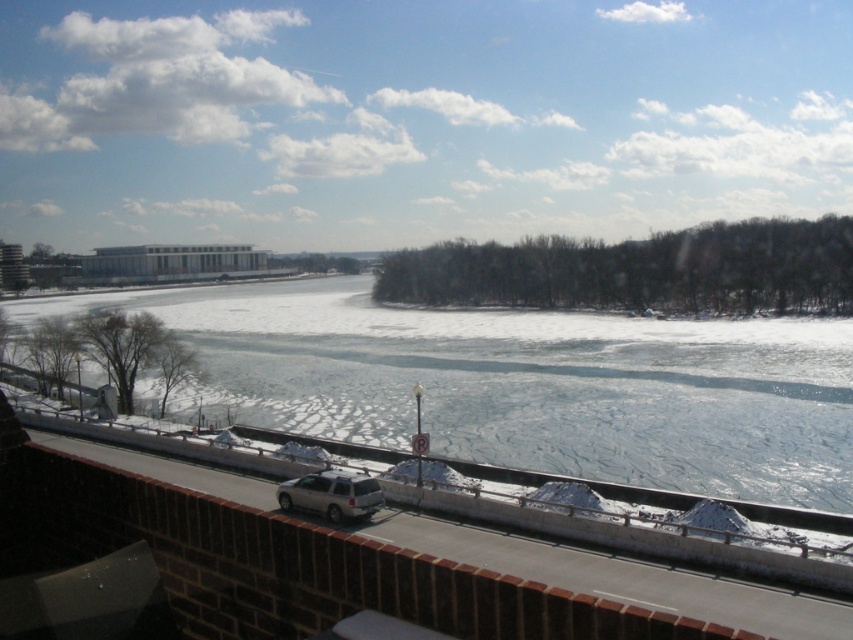
Consider the image. You are standing on the rooftop where the silver SUV is parked. You want to throw a small snowball to hit the frozen ice at center. Is the distance feasible for an average person?

The frozen ice at center is 29.89 meters away from camera. An average person can throw a snowball about 20 meters, so it would be difficult to reach the frozen ice at center from here.

Looking at this image, you are a delivery person trying to park your vehicle on the frozen ice at center. The silver metallic suv at center is already parked there. Can you park your vehicle next to the SUV without going over the edge of the ice? Please explain your reasoning based on their positions.

The frozen ice at center is positioned on the left side of the silver metallic suv at center. Since the SUV is already parked there, there might not be enough space to park next to it on the left side. Additionally, the edge of the ice is near the railing, so moving further left could risk going over the edge. Therefore, parking next to the SUV might not be safe or possible.